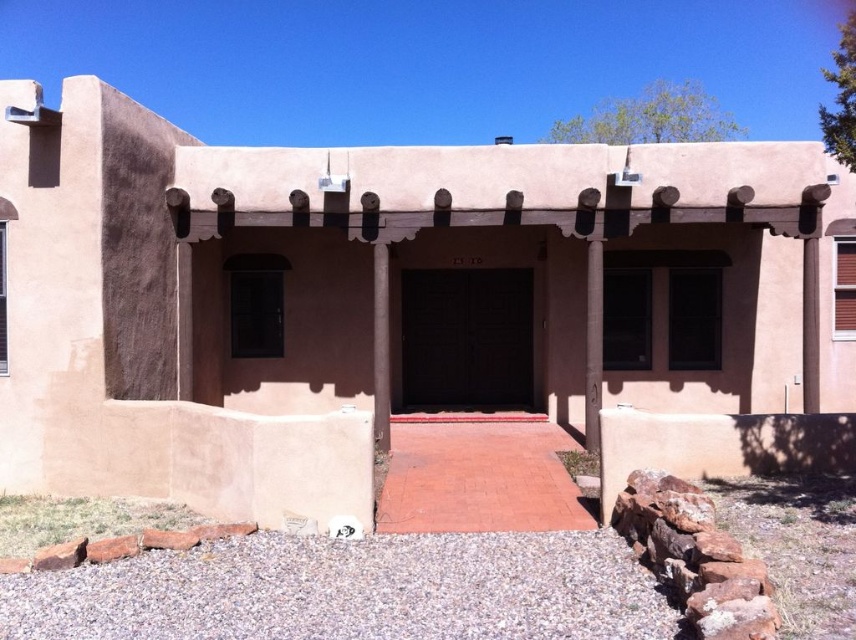
You are standing at the entrance of the traditional adobe house and want to place a decorative pot exactly at the center of the porch. The porch has a smooth concrete pillar at center. Can you tell me the coordinates where you should place the pot?

The smooth concrete pillar at center is located at coordinates point (593, 342), so you should place the decorative pot at those coordinates to position it exactly at the center of the porch.